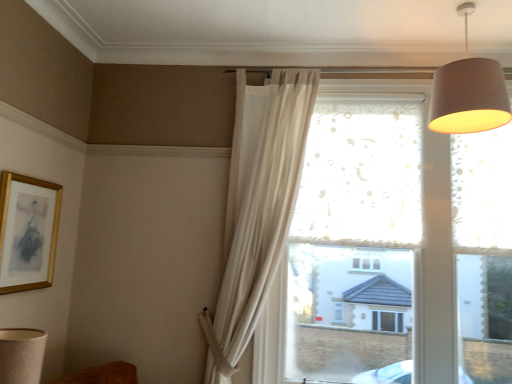
Where is `matte gray lampshade at upper right`? The image size is (512, 384). matte gray lampshade at upper right is located at coordinates tap(469, 93).

This screenshot has height=384, width=512. Describe the element at coordinates (262, 215) in the screenshot. I see `frosted glass window at center` at that location.

This screenshot has height=384, width=512. What are the coordinates of `white sheer curtain at upper center` in the screenshot? It's located at (263, 203).

From a real-world perspective, which is physically below, matte gray lampshade at upper right or frosted glass window at center?

From a 3D spatial view, frosted glass window at center is below.

Considering the points (502, 96) and (272, 237), which point is in front, point (502, 96) or point (272, 237)?

The point (502, 96) is more forward.

I want to click on lamp located above the frosted glass window at center (from the image's perspective), so click(x=469, y=93).

In the scene shown: Is beige fabric lampshade at lower left facing towards gold wooden picture frame at upper left?

No, beige fabric lampshade at lower left is not facing towards gold wooden picture frame at upper left.

Is beige fabric lampshade at lower left not close to gold wooden picture frame at upper left?

No, beige fabric lampshade at lower left is in close proximity to gold wooden picture frame at upper left.

From a real-world perspective, who is located lower, beige fabric lampshade at lower left or gold wooden picture frame at upper left?

beige fabric lampshade at lower left, from a real-world perspective.

Measure the distance from beige fabric lampshade at lower left to gold wooden picture frame at upper left.

They are 36.65 inches apart.

From their relative heights in the image, would you say frosted glass window at center is taller or shorter than white sheer curtain at upper center?

Considering their sizes, frosted glass window at center has more height than white sheer curtain at upper center.

From a real-world perspective, is frosted glass window at center below white sheer curtain at upper center?

Yes.

Which is in front, point (209, 352) or point (250, 111)?

Point (209, 352)

From a real-world perspective, which is physically above, matte gray lampshade at upper right or gold wooden picture frame at upper left?

From a 3D spatial view, matte gray lampshade at upper right is above.

Where is `picture frame on the left of matte gray lampshade at upper right`? picture frame on the left of matte gray lampshade at upper right is located at coordinates 27,232.

In the scene shown: From the image's perspective, is white sheer curtain at upper center located above or below matte gray lampshade at upper right?

From the image's perspective, white sheer curtain at upper center appears below matte gray lampshade at upper right.

Considering the sizes of objects white sheer curtain at upper center and matte gray lampshade at upper right in the image provided, who is smaller, white sheer curtain at upper center or matte gray lampshade at upper right?

Smaller between the two is matte gray lampshade at upper right.

Is white sheer curtain at upper center outside of matte gray lampshade at upper right?

That's correct, white sheer curtain at upper center is outside of matte gray lampshade at upper right.

Considering the relative positions of frosted glass window at center and beige fabric lampshade at lower left in the image provided, is frosted glass window at center to the left or to the right of beige fabric lampshade at lower left?

In the image, frosted glass window at center appears on the right side of beige fabric lampshade at lower left.

In the image, is frosted glass window at center positioned in front of or behind beige fabric lampshade at lower left?

Visually, frosted glass window at center is located behind beige fabric lampshade at lower left.

Between point (298, 70) and point (1, 337), which one is positioned in front?

The point (1, 337) is closer.

Considering the sizes of objects frosted glass window at center and beige fabric lampshade at lower left in the image provided, who is smaller, frosted glass window at center or beige fabric lampshade at lower left?

Smaller between the two is beige fabric lampshade at lower left.

Is white sheer curtain at upper center at the right side of beige fabric lampshade at lower left?

Correct, you'll find white sheer curtain at upper center to the right of beige fabric lampshade at lower left.

Measure the distance from white sheer curtain at upper center to beige fabric lampshade at lower left.

A distance of 4.46 feet exists between white sheer curtain at upper center and beige fabric lampshade at lower left.

Locate an element on the screen. The image size is (512, 384). curtain above the beige fabric lampshade at lower left (from a real-world perspective) is located at coordinates (263, 203).

Considering the positions of objects white sheer curtain at upper center and beige fabric lampshade at lower left in the image provided, who is behind, white sheer curtain at upper center or beige fabric lampshade at lower left?

white sheer curtain at upper center is further away from the camera.

This screenshot has height=384, width=512. I want to click on window below the matte gray lampshade at upper right (from the image's perspective), so click(262, 215).

The width and height of the screenshot is (512, 384). Find the location of `table lamp below the gold wooden picture frame at upper left (from a real-world perspective)`. table lamp below the gold wooden picture frame at upper left (from a real-world perspective) is located at coordinates (21, 355).

Which object lies nearer to the anchor point white sheer curtain at upper center, beige fabric lampshade at lower left or frosted glass window at center?

The object closer to white sheer curtain at upper center is frosted glass window at center.

Looking at this image, considering their positions, is beige fabric lampshade at lower left positioned further to white sheer curtain at upper center than matte gray lampshade at upper right?

beige fabric lampshade at lower left.

Estimate the real-world distances between objects in this image. Which object is closer to beige fabric lampshade at lower left, frosted glass window at center or matte gray lampshade at upper right?

frosted glass window at center is positioned closer to the anchor beige fabric lampshade at lower left.

From the image, which object appears to be farther from frosted glass window at center, gold wooden picture frame at upper left or white sheer curtain at upper center?

gold wooden picture frame at upper left.

Based on their spatial positions, is beige fabric lampshade at lower left or frosted glass window at center further from gold wooden picture frame at upper left?

The object further to gold wooden picture frame at upper left is frosted glass window at center.

Considering their positions, is white sheer curtain at upper center positioned further to frosted glass window at center than matte gray lampshade at upper right?

The object further to frosted glass window at center is matte gray lampshade at upper right.

From the image, which object appears to be farther from white sheer curtain at upper center, matte gray lampshade at upper right or frosted glass window at center?

Among the two, matte gray lampshade at upper right is located further to white sheer curtain at upper center.

When comparing their distances from beige fabric lampshade at lower left, does matte gray lampshade at upper right or frosted glass window at center seem further?

Based on the image, matte gray lampshade at upper right appears to be further to beige fabric lampshade at lower left.

Identify the location of curtain between beige fabric lampshade at lower left and matte gray lampshade at upper right from left to right. (263, 203).

Locate an element on the screen. table lamp situated between gold wooden picture frame at upper left and frosted glass window at center from left to right is located at coordinates (21, 355).

This screenshot has height=384, width=512. Identify the location of table lamp between gold wooden picture frame at upper left and white sheer curtain at upper center from left to right. (21, 355).

Identify the location of curtain between beige fabric lampshade at lower left and frosted glass window at center from left to right. (263, 203).